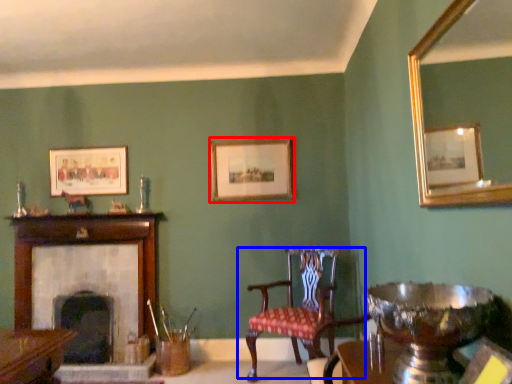
Question: Which object is further to the camera taking this photo, picture frame (highlighted by a red box) or chair (highlighted by a blue box)?

Choices:
 (A) picture frame
 (B) chair

Answer: (A)